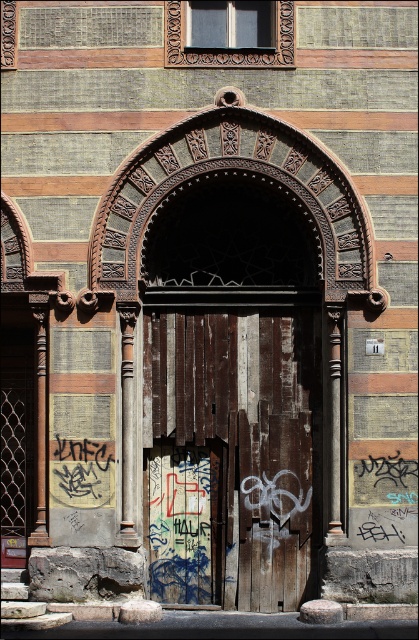
Looking at this image, you are a painter who wants to place a 6.5 inch wide decorative plaque between the weathered wood door at center and the grungy wooden door at center. Can the plaque fit in the space between them?

The weathered wood door at center and the grungy wooden door at center are 6.58 inches apart. Since the plaque is 6.5 inches wide, it can fit in the space between them as the available space is slightly larger than the plaque.

You are an architect analyzing the door structure in the image. You see the weathered wood door at center and the grungy wooden door at center. Which one is positioned lower?

The weathered wood door at center is below the grungy wooden door at center, so the weathered wood door at center is positioned lower.

You are standing in front of the weathered wooden door with the ornate carved archway. There are two points marked on the door, one at coordinates point [263,442] and the other at point [150,545]. Which point is nearer to you?

Point [263,442] is closer to the camera than point [150,545].